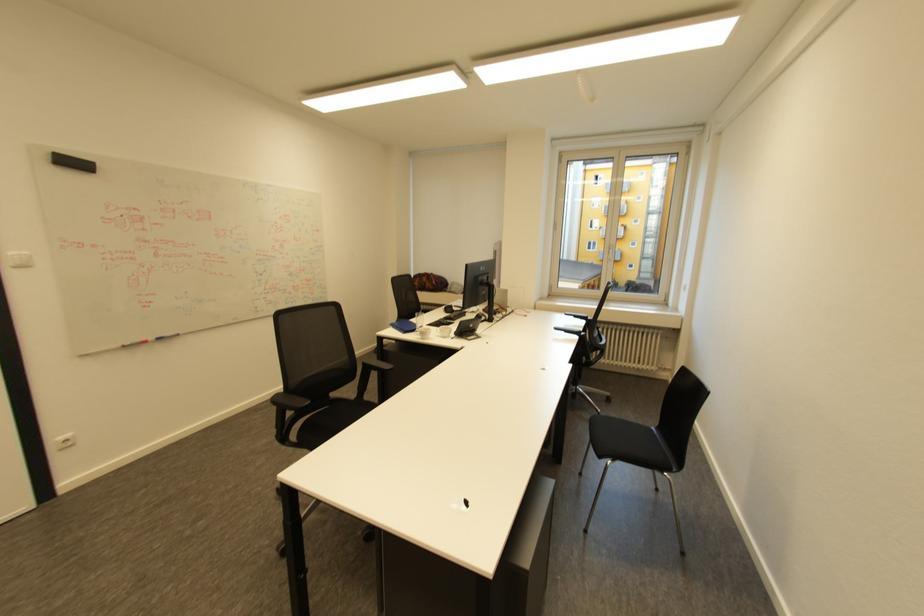
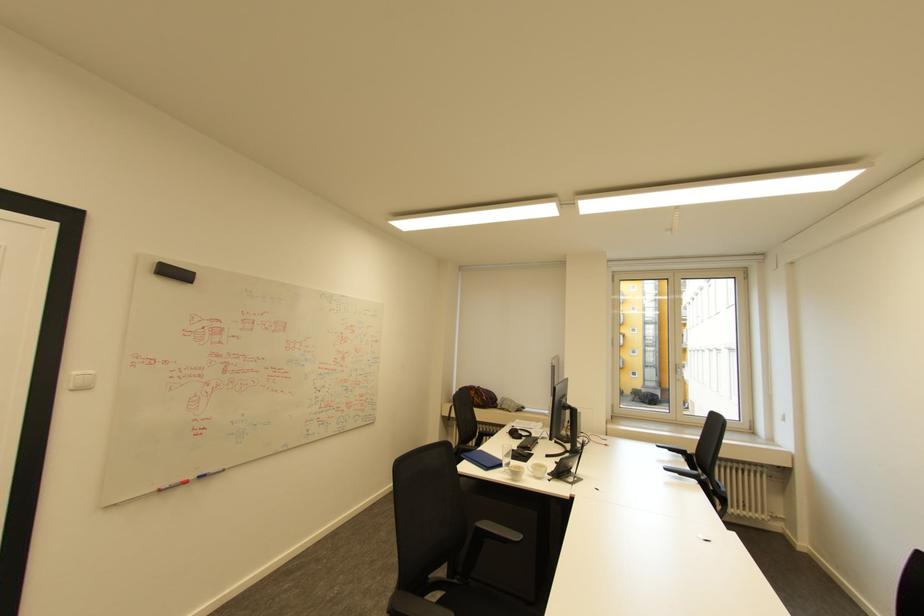
Locate, in the second image, the point that corresponds to pixel 164 339 in the first image.

(207, 477)